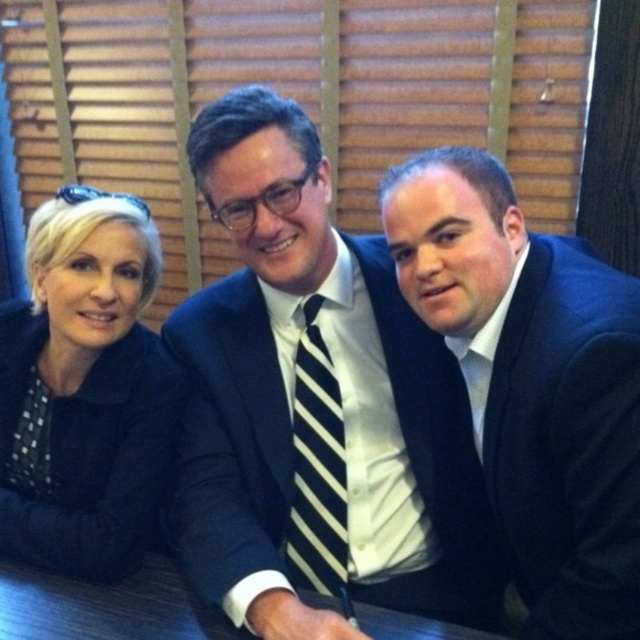
What do you see at coordinates (316, 403) in the screenshot? This screenshot has height=640, width=640. I see `dark blue suit at center` at bounding box center [316, 403].

Between point (472, 472) and point (525, 234), which one is positioned behind?

The point (472, 472) is behind.

The image size is (640, 640). What are the coordinates of `dark blue suit at center` in the screenshot? It's located at (316, 403).

The image size is (640, 640). I want to click on dark blue suit at center, so click(316, 403).

Which is behind, point (378, 412) or point (61, 500)?

Positioned behind is point (61, 500).

Can you confirm if dark blue suit at center is bigger than black dotted shirt at left?

Correct, dark blue suit at center is larger in size than black dotted shirt at left.

What are the coordinates of `dark blue suit at center` in the screenshot? It's located at (316, 403).

Is matte black suit at right in front of black dotted shirt at left?

Yes.

Between matte black suit at right and black dotted shirt at left, which one is positioned higher?

matte black suit at right

Between point (416, 163) and point (108, 269), which one is positioned in front?

Point (416, 163)

This screenshot has height=640, width=640. I want to click on matte black suit at right, so click(532, 381).